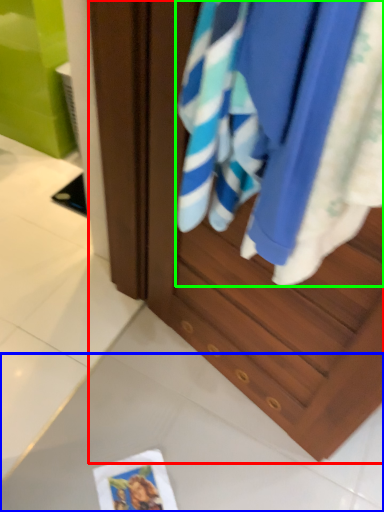
Question: Based on their relative distances, which object is farther from cabinetry (highlighted by a red box)? Choose from tile (highlighted by a blue box) and beach towel (highlighted by a green box).

Choices:
 (A) tile
 (B) beach towel

Answer: (A)